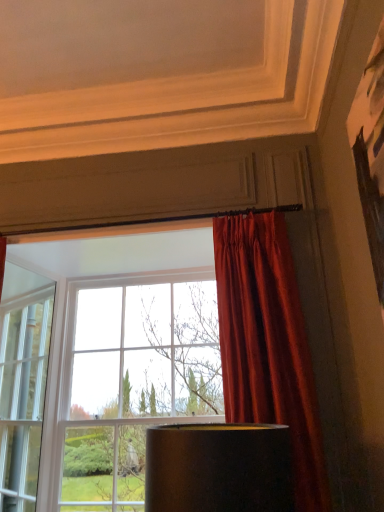
Question: Visually, is matte glass window at center positioned to the left or to the right of satin red curtain at right?

Choices:
 (A) right
 (B) left

Answer: (B)

Question: In the image, is matte glass window at center positioned in front of or behind satin red curtain at right?

Choices:
 (A) behind
 (B) front

Answer: (A)

Question: In terms of height, does matte glass window at center look taller or shorter compared to satin red curtain at right?

Choices:
 (A) short
 (B) tall

Answer: (B)

Question: Is point (309, 395) closer or farther from the camera than point (281, 268)?

Choices:
 (A) farther
 (B) closer

Answer: (B)

Question: From the image's perspective, is satin red curtain at right located above or below matte glass window at center?

Choices:
 (A) above
 (B) below

Answer: (A)

Question: Is satin red curtain at right situated inside matte glass window at center or outside?

Choices:
 (A) outside
 (B) inside

Answer: (A)

Question: Based on their sizes in the image, would you say satin red curtain at right is bigger or smaller than matte glass window at center?

Choices:
 (A) big
 (B) small

Answer: (B)